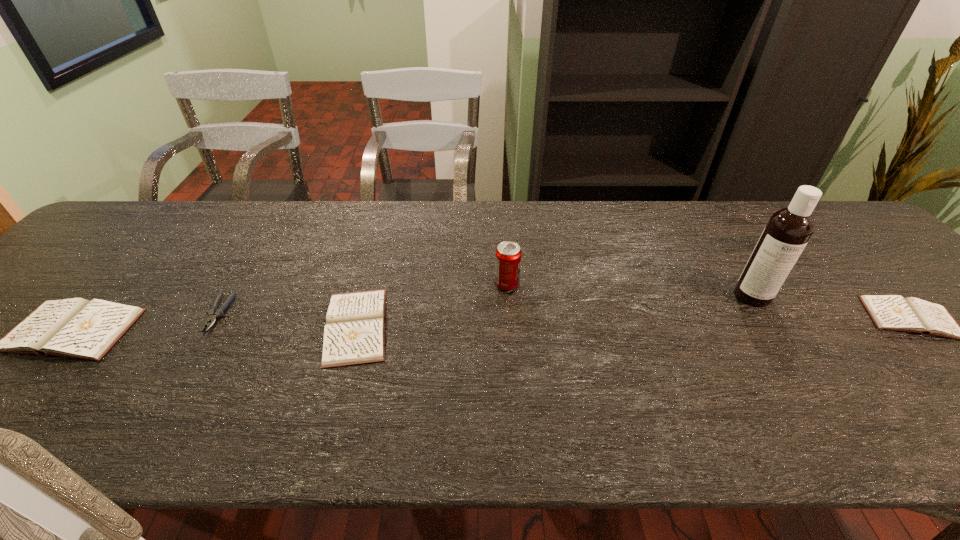
Where is `free location located on the label side of the fifth object from left to right`? This screenshot has height=540, width=960. free location located on the label side of the fifth object from left to right is located at coordinates (811, 386).

Image resolution: width=960 pixels, height=540 pixels. Find the location of `vacant space located 0.180m at the gripping part of the pliers`. vacant space located 0.180m at the gripping part of the pliers is located at coordinates (163, 403).

Where is `object present at the near edge`? The width and height of the screenshot is (960, 540). object present at the near edge is located at coordinates pyautogui.click(x=354, y=333).

Find the location of a particular element. vacant space at the far edge is located at coordinates (222, 221).

Image resolution: width=960 pixels, height=540 pixels. In the image, there is a desktop. What are the coordinates of `free space at the near edge` in the screenshot? It's located at (906, 372).

Where is `blank space at the left edge of the desktop`? Image resolution: width=960 pixels, height=540 pixels. blank space at the left edge of the desktop is located at coordinates (x=10, y=317).

This screenshot has width=960, height=540. In the image, there is a desktop. Identify the location of vacant space at the far left corner. (122, 233).

What are the coordinates of `vacant space that is in between the second object from left to right and the second tallest diary` in the screenshot? It's located at (287, 320).

The image size is (960, 540). Identify the location of free spot between the shortest object and the fifth object from left to right. (485, 305).

Find the location of a particular element. The width and height of the screenshot is (960, 540). empty space between the tallest object and the fourth tallest object is located at coordinates (554, 310).